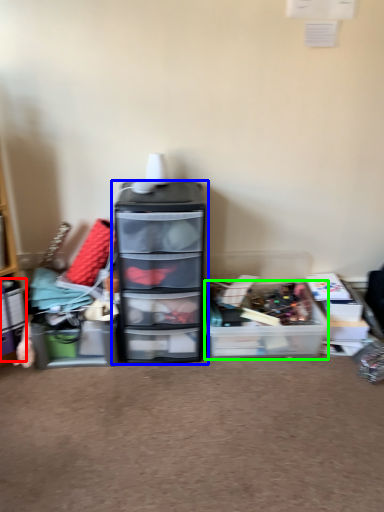
Question: Which object is positioned farthest from storage box (highlighted by a red box)? Select from chest of drawers (highlighted by a blue box) and storage box (highlighted by a green box).

Choices:
 (A) chest of drawers
 (B) storage box

Answer: (B)